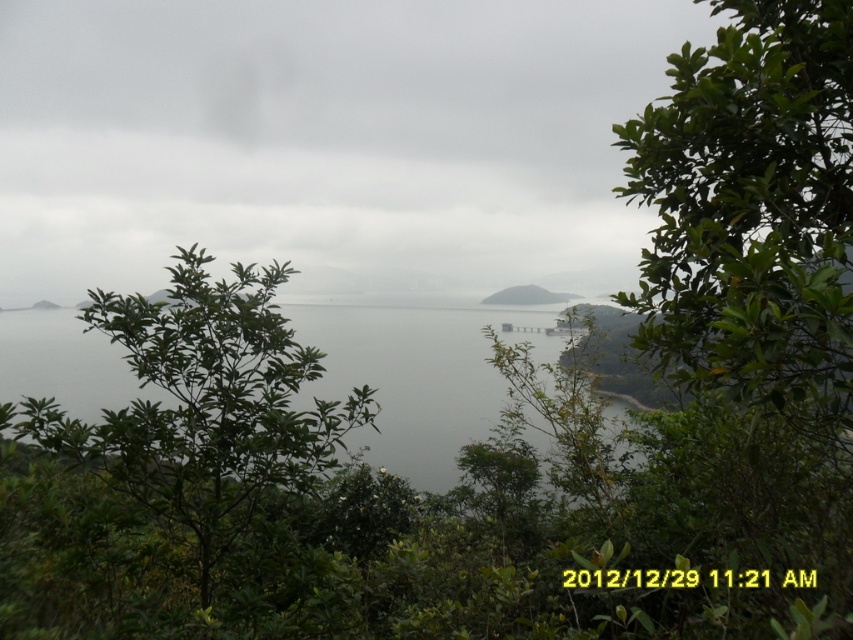
Is green leafy tree at right to the left of gray water at center from the viewer's perspective?

No, green leafy tree at right is not to the left of gray water at center.

Who is higher up, green leafy tree at right or gray water at center?

Positioned higher is green leafy tree at right.

Who is more forward, (718, 29) or (13, 326)?

Positioned in front is point (718, 29).

Find the location of `green leafy tree at right`. green leafy tree at right is located at coordinates (752, 208).

Does green leafy tree at right have a smaller size compared to green leafy tree at center?

Correct, green leafy tree at right occupies less space than green leafy tree at center.

How much distance is there between green leafy tree at right and green leafy tree at center?

green leafy tree at right is 8.49 feet away from green leafy tree at center.

Does point (706, 358) lie in front of point (196, 291)?

That is True.

Image resolution: width=853 pixels, height=640 pixels. Identify the location of green leafy tree at right. click(752, 208).

Which is in front, point (187, 403) or point (390, 436)?

Positioned in front is point (187, 403).

Does green leafy tree at center have a lesser height compared to gray water at center?

No.

Image resolution: width=853 pixels, height=640 pixels. Describe the element at coordinates (206, 408) in the screenshot. I see `green leafy tree at center` at that location.

Where is `green leafy tree at center`? green leafy tree at center is located at coordinates (206, 408).